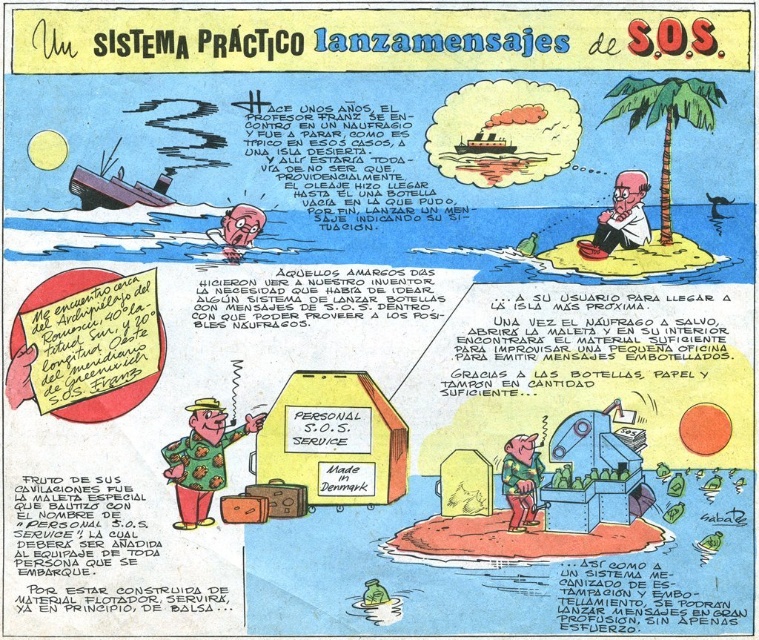
In the comic strip titled SISTEMA PRACTICO LANZAMENSAJES DE S.O.S., there is a polka dot fabric suitcase at center and a white paper at upper center. Which object is positioned higher in the image?

The white paper at upper center is positioned higher than the polka dot fabric suitcase at center.